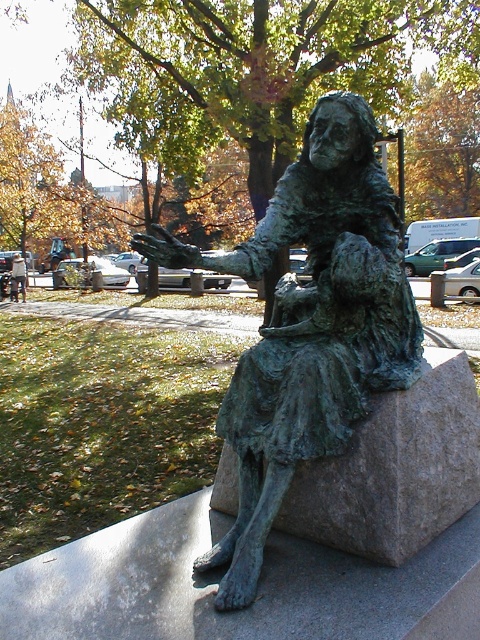
Between point (380, 356) and point (22, 282), which one is positioned behind?

The point (22, 282) is behind.

Does green patina bronze statue at center have a greater height compared to metallic gray statue at center?

Correct, green patina bronze statue at center is much taller as metallic gray statue at center.

Who is more forward, (392, 212) or (17, 256)?

Point (392, 212) is more forward.

Identify the location of green patina bronze statue at center. (310, 324).

Is green patina stone at center to the left of metallic gray statue at center from the viewer's perspective?

No, green patina stone at center is not to the left of metallic gray statue at center.

Does green patina stone at center have a lesser height compared to metallic gray statue at center?

Correct, green patina stone at center is not as tall as metallic gray statue at center.

Where is `green patina stone at center`? This screenshot has height=640, width=480. green patina stone at center is located at coordinates coord(396,468).

You are a GUI agent. You are given a task and a screenshot of the screen. Output one action in this format:
    pyautogui.click(x=<x>, y=<y>)
    Task: Click on the green patina stone at center
    
    Given the screenshot: What is the action you would take?
    pyautogui.click(x=396, y=468)

Can you confirm if green patina bronze statue at center is taller than green patina stone at center?

Correct, green patina bronze statue at center is much taller as green patina stone at center.

Measure the distance from green patina bronze statue at center to green patina stone at center.

green patina bronze statue at center is 12.91 inches away from green patina stone at center.

The width and height of the screenshot is (480, 640). What are the coordinates of `green patina bronze statue at center` in the screenshot? It's located at (310, 324).